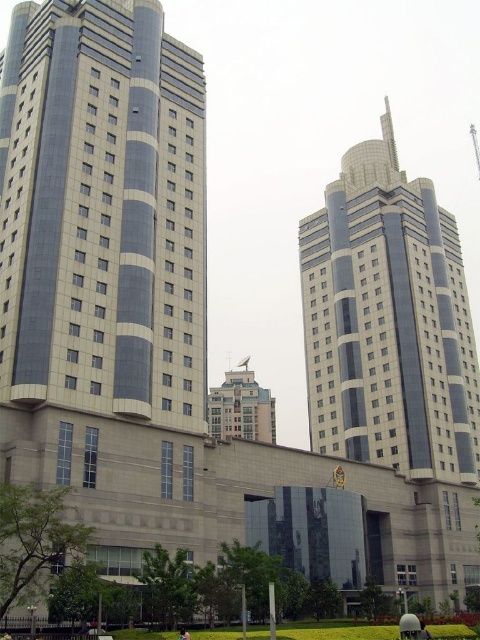
Question: Which of the following is the closest to the observer?

Choices:
 (A) smooth glass tower at center
 (B) light brown fabric shirt at center

Answer: (B)

Question: Does smooth glass tower at center appear under light brown fabric shirt at center?

Choices:
 (A) yes
 (B) no

Answer: (B)

Question: Is smooth glass tower at center above light brown fabric shirt at center?

Choices:
 (A) yes
 (B) no

Answer: (A)

Question: Which object appears farthest from the camera in this image?

Choices:
 (A) light brown fabric shirt at center
 (B) smooth glass tower at center

Answer: (B)

Question: Is smooth glass tower at center positioned at the back of light brown fabric shirt at center?

Choices:
 (A) yes
 (B) no

Answer: (A)